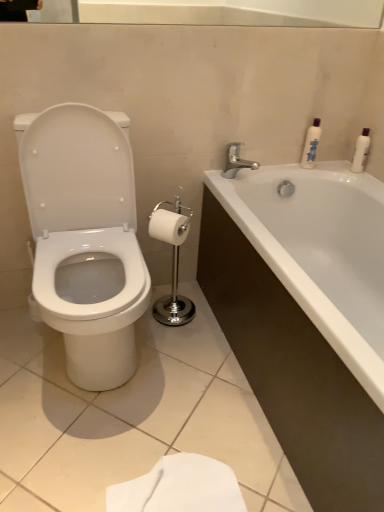
Question: Is white glossy bathtub at right outside of white glossy lotion at upper right, the first toiletry positioned from the left?

Choices:
 (A) no
 (B) yes

Answer: (B)

Question: Considering the relative positions of white glossy bathtub at right and white glossy lotion at upper right, which is the second toiletry in right-to-left order, in the image provided, is white glossy bathtub at right to the right of white glossy lotion at upper right, which is the second toiletry in right-to-left order, from the viewer's perspective?

Choices:
 (A) no
 (B) yes

Answer: (B)

Question: Does white glossy bathtub at right have a greater height compared to white glossy lotion at upper right, which is the second toiletry in right-to-left order?

Choices:
 (A) no
 (B) yes

Answer: (B)

Question: Is white glossy bathtub at right positioned in front of white glossy lotion at upper right, which is the second toiletry in right-to-left order?

Choices:
 (A) yes
 (B) no

Answer: (A)

Question: Does white glossy bathtub at right have a smaller size compared to white glossy lotion at upper right, the first toiletry positioned from the left?

Choices:
 (A) yes
 (B) no

Answer: (B)

Question: Does white glossy bathtub at right have a larger size compared to white glossy lotion at upper right, the first toiletry positioned from the left?

Choices:
 (A) no
 (B) yes

Answer: (B)

Question: Is white glossy lotion at upper right, which is the second toiletry in right-to-left order, positioned beyond the bounds of silver metallic faucet at upper right?

Choices:
 (A) no
 (B) yes

Answer: (B)

Question: Is white glossy lotion at upper right, which is the second toiletry in right-to-left order, facing towards silver metallic faucet at upper right?

Choices:
 (A) no
 (B) yes

Answer: (A)

Question: Considering the relative sizes of white glossy lotion at upper right, the first toiletry positioned from the left, and silver metallic faucet at upper right in the image provided, is white glossy lotion at upper right, the first toiletry positioned from the left, taller than silver metallic faucet at upper right?

Choices:
 (A) yes
 (B) no

Answer: (A)

Question: From a real-world perspective, is white glossy lotion at upper right, which is the second toiletry in right-to-left order, under silver metallic faucet at upper right?

Choices:
 (A) yes
 (B) no

Answer: (B)

Question: Is white glossy lotion at upper right, the first toiletry positioned from the left, facing away from silver metallic faucet at upper right?

Choices:
 (A) yes
 (B) no

Answer: (B)

Question: Could silver metallic faucet at upper right be considered to be inside white glossy lotion at upper right, the first toiletry positioned from the left?

Choices:
 (A) yes
 (B) no

Answer: (B)

Question: From the image's perspective, is white glossy toilet at left located beneath white glossy bathtub at right?

Choices:
 (A) yes
 (B) no

Answer: (B)